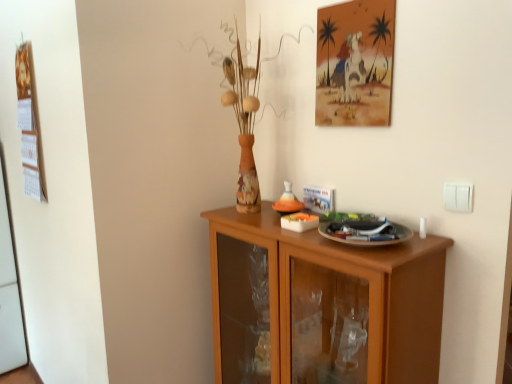
Question: From the image's perspective, is wooden calendar at left, which is counted as the 1th picture frame, starting from the left, above or below brown wooden cabinet at center?

Choices:
 (A) above
 (B) below

Answer: (A)

Question: Is wooden calendar at left, which is counted as the 1th picture frame, starting from the left, bigger or smaller than brown wooden cabinet at center?

Choices:
 (A) small
 (B) big

Answer: (A)

Question: Estimate the real-world distances between objects in this image. Which object is closer to the watercolor paper painting at upper center, which is the second picture frame in left-to-right order?

Choices:
 (A) brown wooden cabinet at center
 (B) white plastic switch at upper right
 (C) wooden calendar at left, which is the 2th picture frame in front-to-back order

Answer: (B)

Question: Estimate the real-world distances between objects in this image. Which object is farther from the wooden calendar at left, which is the 2th picture frame from right to left?

Choices:
 (A) white plastic switch at upper right
 (B) watercolor paper painting at upper center, which is the 1th picture frame in front-to-back order
 (C) brown wooden cabinet at center

Answer: (A)